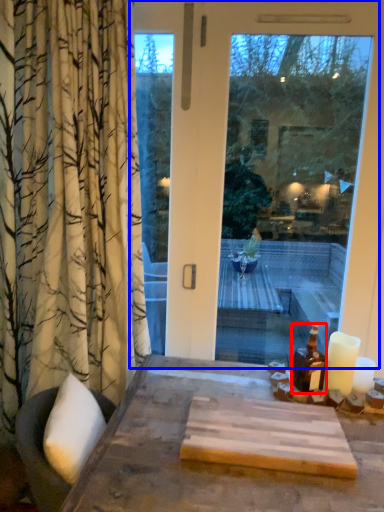
Question: Which object appears farthest to the camera in this image, bottle (highlighted by a red box) or window (highlighted by a blue box)?

Choices:
 (A) bottle
 (B) window

Answer: (B)